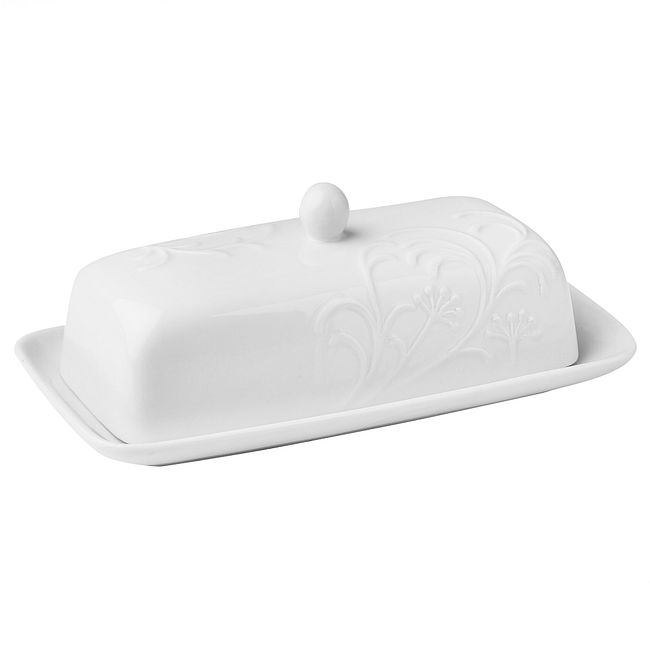
Where is `dish plate`? This screenshot has width=650, height=650. dish plate is located at coordinates (239, 441).